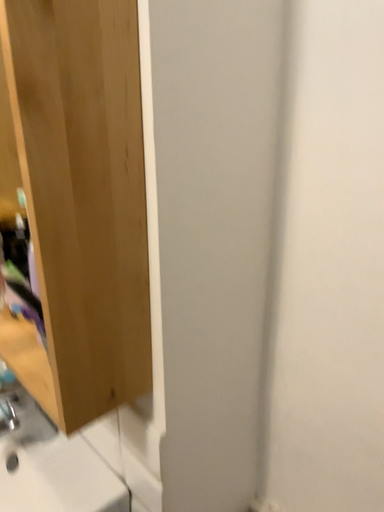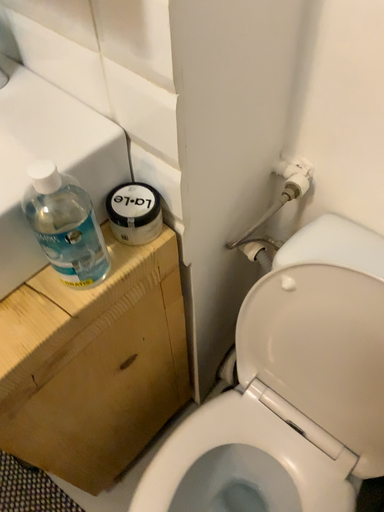
Question: How did the camera likely rotate when shooting the video?

Choices:
 (A) rotated downward
 (B) rotated upward

Answer: (A)